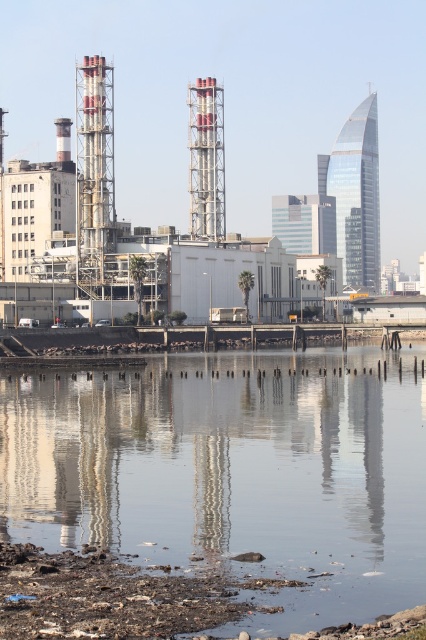
You are standing at the point marked by the coordinate point [233,468] in the urban landscape. Describe what you see around you based on the scene description provided.

The point [233,468] marks transparent water at center, so you are standing in the transparent water at center of the urban landscape. Around you, you can see an industrial complex with red and white chimneys on the left, palm trees in the middle ground, and reflections of buildings in the calm water.

Looking at this image, you are standing in the urban landscape scene and want to move from the point closer to you to the point further away. Which path would you take between the two points, point (267, 472) and point (175, 273)?

You should move from point (267, 472) to point (175, 273) because point (267, 472) is closer to the viewer and the other point is further away.